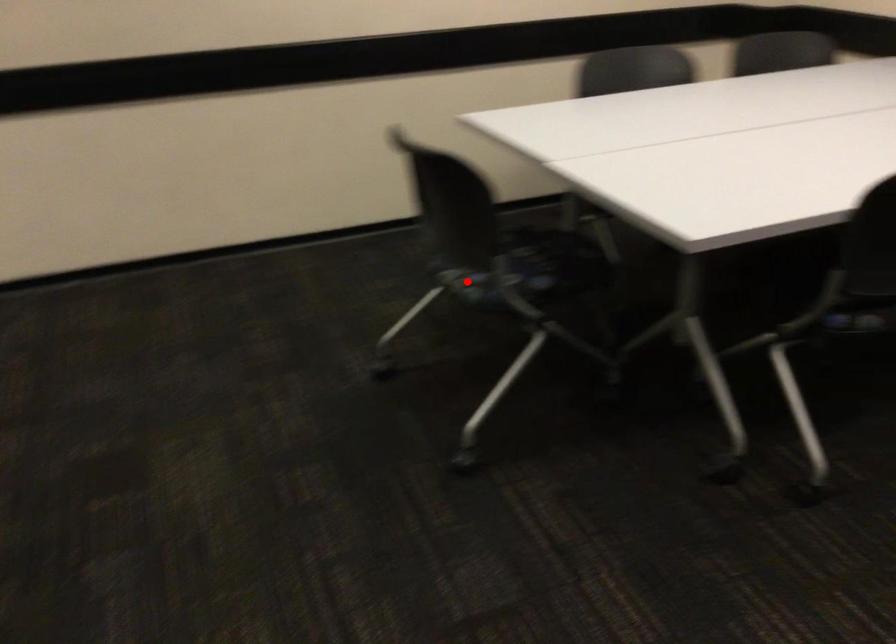
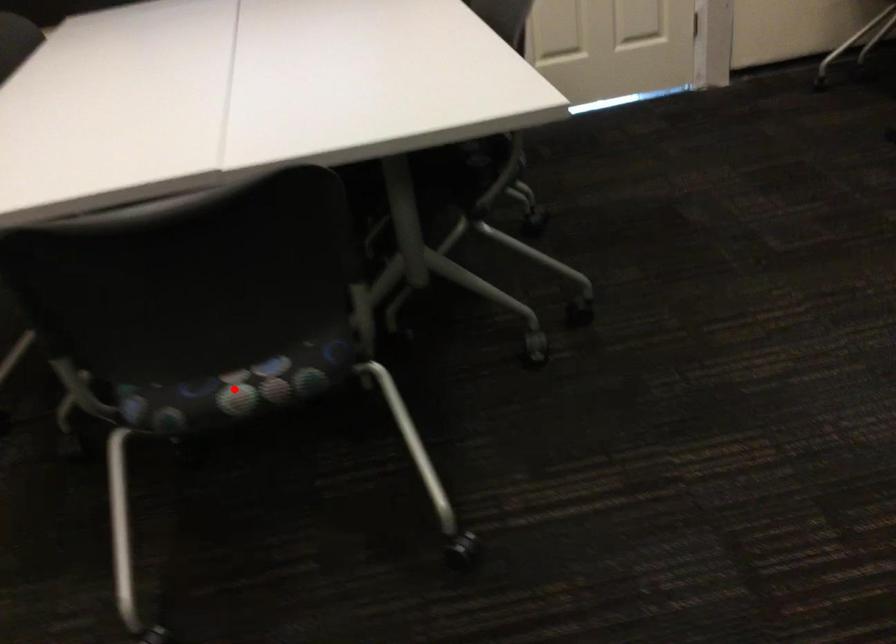
I am providing you with two images of the same scene from different viewpoints. A red point is marked on the first image and another point is marked on the second image. Do the highlighted points in image1 and image2 indicate the same real-world spot?

Yes